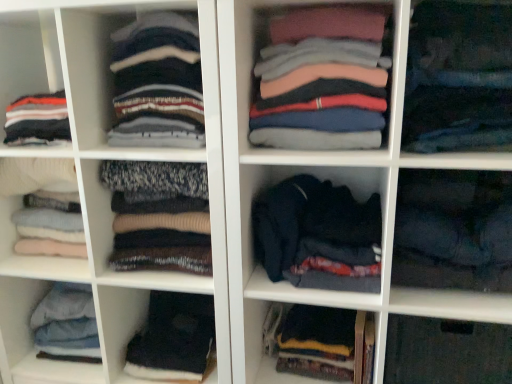
Question: Looking at the image, does pink cotton shirts at center, the fifth clothing viewed from the left, seem bigger or smaller compared to knit sweater at left, which is the 1th clothing from left to right?

Choices:
 (A) small
 (B) big

Answer: (B)

Question: From the image's perspective, is pink cotton shirts at center, the fifth clothing viewed from the left, positioned above or below knit sweater at left, the ninth clothing in the right-to-left sequence?

Choices:
 (A) above
 (B) below

Answer: (A)

Question: Estimate the real-world distances between objects in this image. Which object is closer to the transparent plastic shelf at lower right?

Choices:
 (A) dark blue fabric at lower center, acting as the fourth clothing starting from the right
 (B) pink cotton shirts at center, the fifth clothing viewed from the left
 (C) dark blue sweater at center
 (D) knit sweater at center, placed as the 8th clothing when sorted from right to left
 (E) knit sweater at left, the ninth clothing in the right-to-left sequence

Answer: (A)

Question: Estimate the real-world distances between objects in this image. Which object is farther from the knit sweater at center, acting as the seventh clothing starting from the right?

Choices:
 (A) transparent plastic shelf at lower right
 (B) knit sweater at center, acting as the second clothing starting from the left
 (C) dark blue fabric at lower right, the first clothing when ordered from right to left
 (D) pink cotton shirts at center, which is the fifth clothing from right to left
 (E) dark blue fabric at center, the third clothing viewed from the right

Answer: (A)